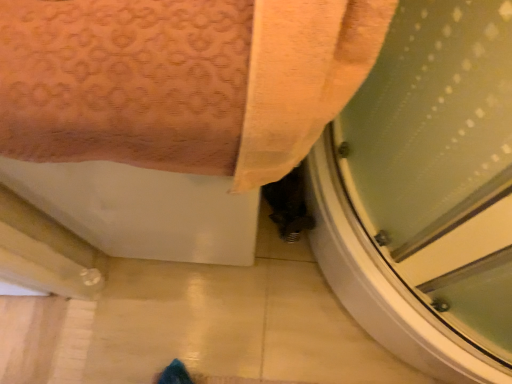
Question: From the image's perspective, is matte pink towel at upper left under transparent plastic screen door at lower right?

Choices:
 (A) yes
 (B) no

Answer: (B)

Question: From the image's perspective, is matte pink towel at upper left on transparent plastic screen door at lower right?

Choices:
 (A) yes
 (B) no

Answer: (A)

Question: Could you tell me if matte pink towel at upper left is facing transparent plastic screen door at lower right?

Choices:
 (A) yes
 (B) no

Answer: (B)

Question: Does matte pink towel at upper left lie in front of transparent plastic screen door at lower right?

Choices:
 (A) yes
 (B) no

Answer: (A)

Question: Is matte pink towel at upper left not close to transparent plastic screen door at lower right?

Choices:
 (A) no
 (B) yes

Answer: (A)

Question: Is matte pink towel at upper left surrounding transparent plastic screen door at lower right?

Choices:
 (A) yes
 (B) no

Answer: (B)

Question: Does transparent plastic screen door at lower right have a larger size compared to matte pink towel at upper left?

Choices:
 (A) yes
 (B) no

Answer: (B)

Question: Is transparent plastic screen door at lower right with matte pink towel at upper left?

Choices:
 (A) no
 (B) yes

Answer: (A)

Question: Does transparent plastic screen door at lower right appear on the left side of matte pink towel at upper left?

Choices:
 (A) yes
 (B) no

Answer: (B)

Question: Can you confirm if transparent plastic screen door at lower right is shorter than matte pink towel at upper left?

Choices:
 (A) no
 (B) yes

Answer: (B)

Question: Can you confirm if transparent plastic screen door at lower right is taller than matte pink towel at upper left?

Choices:
 (A) yes
 (B) no

Answer: (B)

Question: From a real-world perspective, is transparent plastic screen door at lower right located higher than matte pink towel at upper left?

Choices:
 (A) yes
 (B) no

Answer: (B)

Question: From a real-world perspective, is matte pink towel at upper left physically located above or below transparent plastic screen door at lower right?

Choices:
 (A) above
 (B) below

Answer: (A)